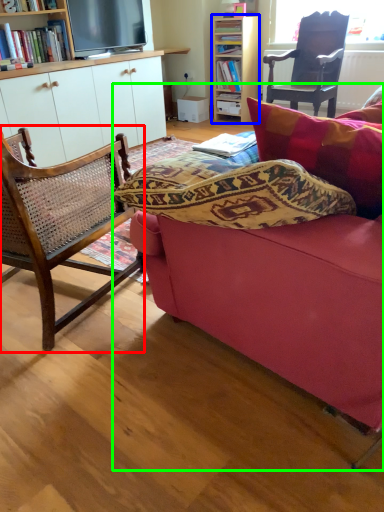
Question: Which object is the closest to the chair (highlighted by a red box)? Choose among these: bookcase (highlighted by a blue box) or studio couch (highlighted by a green box).

Choices:
 (A) bookcase
 (B) studio couch

Answer: (B)